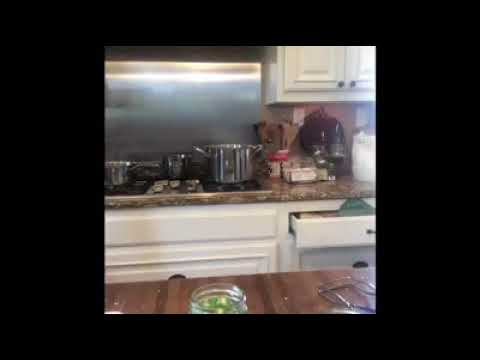
The width and height of the screenshot is (480, 360). Identify the location of handle. (340, 87).